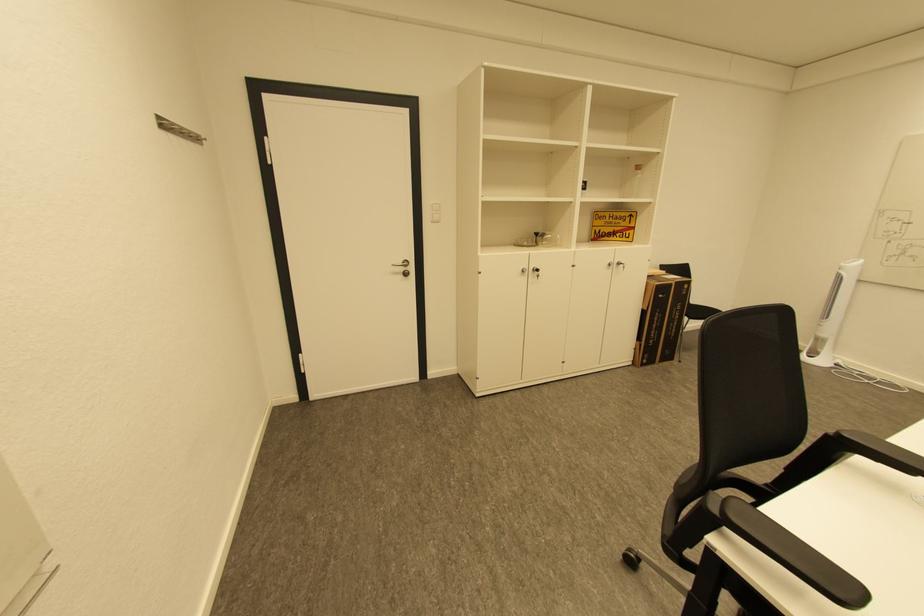
Where is `yellow sign`? yellow sign is located at coordinates (613, 225).